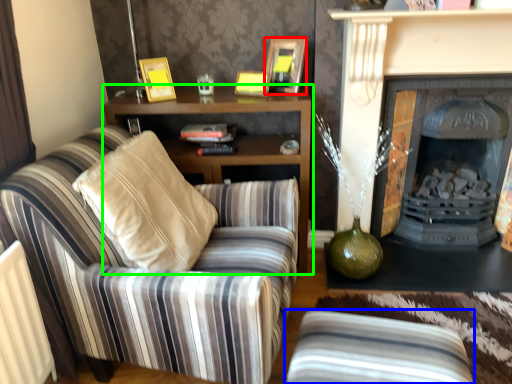
Question: Estimate the real-world distances between objects in this image. Which object is farther from picture frame (highlighted by a red box), studio couch (highlighted by a blue box) or cabinetry (highlighted by a green box)?

Choices:
 (A) studio couch
 (B) cabinetry

Answer: (A)